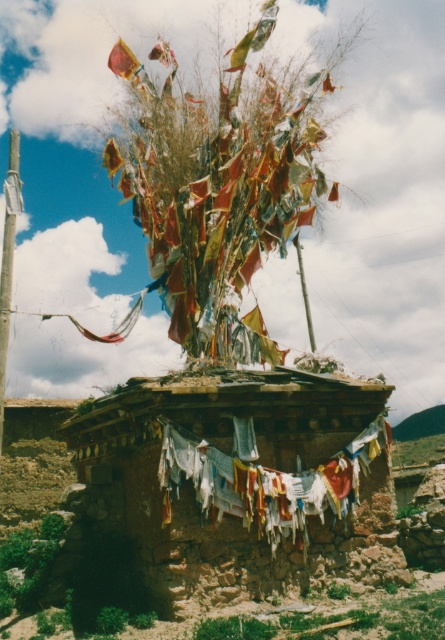
You are standing in front of the brown textured hut at center and want to hang a large banner on the worn fabric clothesline at center. Considering their sizes, will the clothesline be able to support the banner without sagging?

The brown textured hut at center has a smaller size compared to worn fabric clothesline at center, so the clothesline is larger and likely more sturdy. It should be able to support the banner without sagging.

You are a visitor standing in front of the brown textured hut at center. You notice the worn fabric clothesline at center above you. Which object is positioned higher relative to the other?

The worn fabric clothesline at center is positioned higher than the brown textured hut at center because it is located above the hut.

You are standing at the origin point of a coordinate system where the image is displayed. The brown textured hut at center is located at coordinates. What are its coordinates?

The brown textured hut at center is located at coordinates point (241, 481).